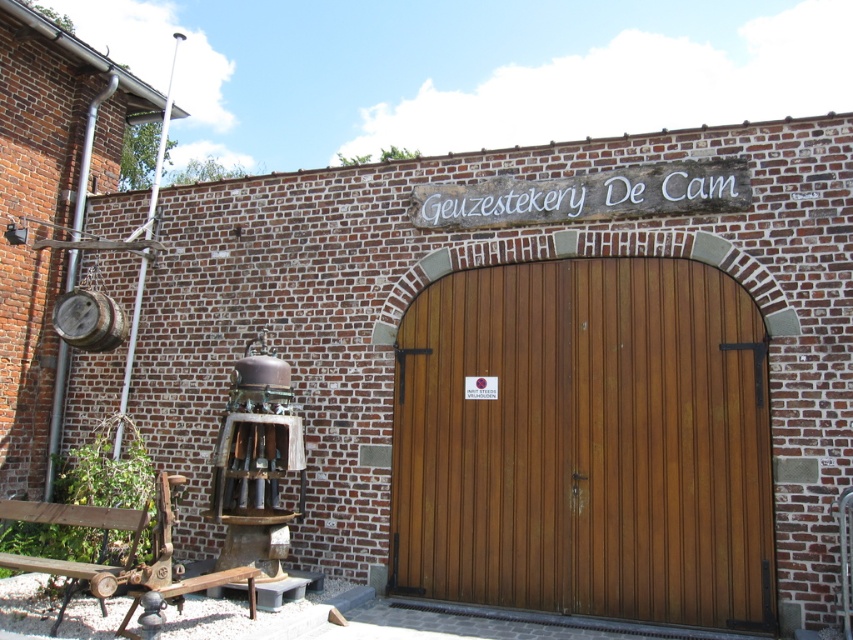
You are standing in front of the brick building and want to locate two specific points marked on the image. The first point is at coordinates point (567,531) and the second point is at point (18,554). Which point is closer to you?

Point (567,531) is in front of point (18,554), so the first point is closer to you.

You are a visitor arriving at the brick building and want to sit down. There is a wooden bench at lower left and a wooden at center. Which one is closer to the entrance?

The wooden bench at lower left is closer to the entrance because the wooden at center is positioned on the right side of it, meaning the bench is nearer to the entrance.

You are a visitor who wants to sit down for a moment. You see the wooden at center and the wooden bench at lower left. Which one has more space to accommodate you?

The wooden at center has a larger width than the wooden bench at lower left, so it can accommodate you better.